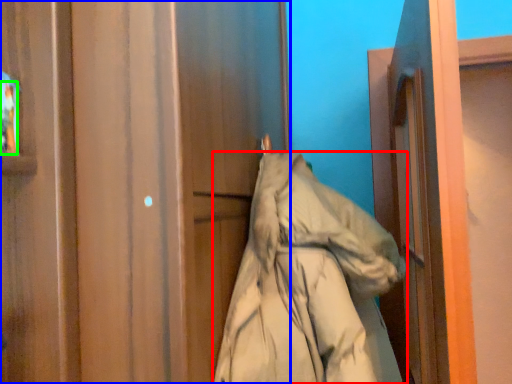
Question: Estimate the real-world distances between objects in this image. Which object is closer to coat (highlighted by a red box), door (highlighted by a blue box) or person (highlighted by a green box)?

Choices:
 (A) door
 (B) person

Answer: (A)